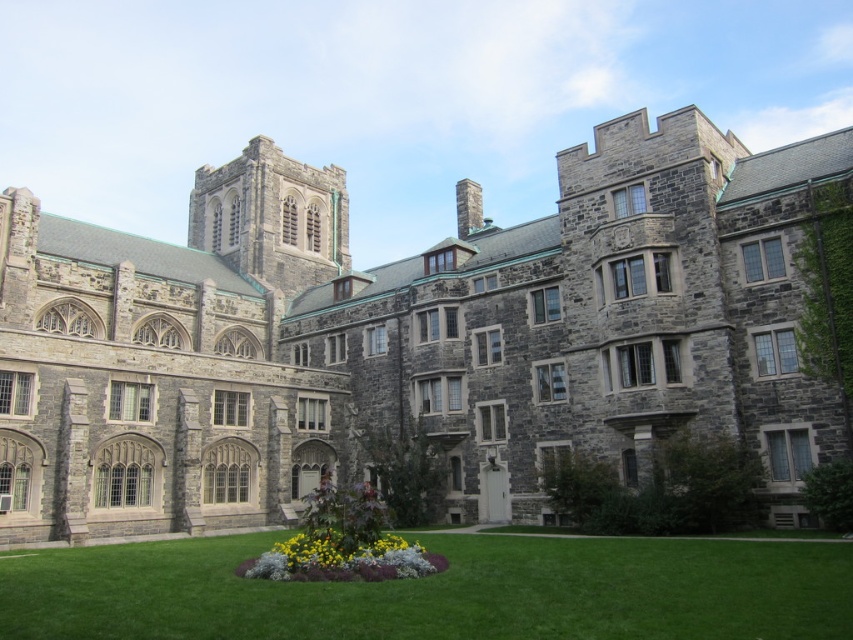
Who is shorter, green grass at lower center or yellow matte flowers at center?

Standing shorter between the two is green grass at lower center.

Does point (204, 628) come behind point (403, 541)?

No, (204, 628) is closer to viewer.

You are a GUI agent. You are given a task and a screenshot of the screen. Output one action in this format:
    pyautogui.click(x=<x>, y=<y>)
    Task: Click on the green grass at lower center
    Image resolution: width=853 pixels, height=640 pixels.
    Given the screenshot: What is the action you would take?
    coord(439,592)